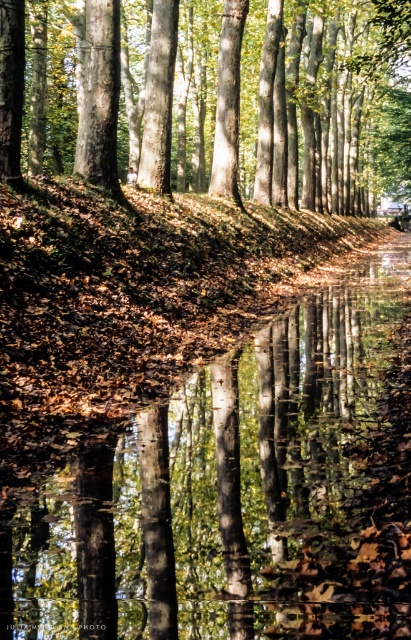
Question: Does brown reflective water at center have a lesser width compared to smooth bark tree at center?

Choices:
 (A) no
 (B) yes

Answer: (B)

Question: Which point is farther to the camera?

Choices:
 (A) smooth bark tree at center
 (B) brown reflective water at center

Answer: (A)

Question: Does brown reflective water at center appear on the left side of smooth bark tree at center?

Choices:
 (A) yes
 (B) no

Answer: (B)

Question: Is brown reflective water at center closer to the viewer compared to smooth bark tree at center?

Choices:
 (A) no
 (B) yes

Answer: (B)

Question: Which point is closer to the camera taking this photo?

Choices:
 (A) (357, 189)
 (B) (330, 296)

Answer: (B)

Question: Which point is farther to the camera?

Choices:
 (A) (304, 147)
 (B) (270, 410)

Answer: (A)